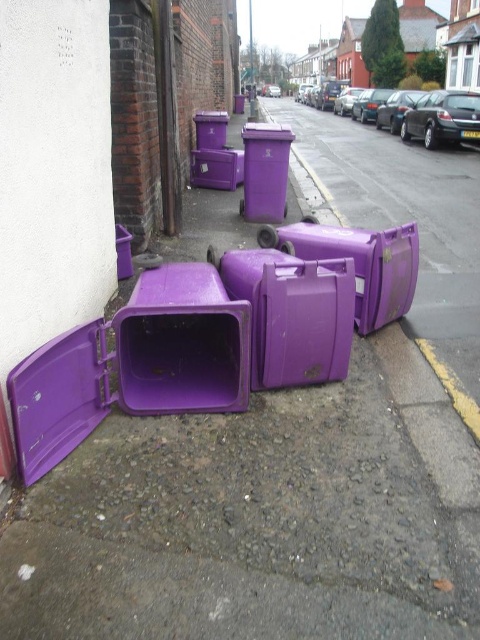
Question: Which point appears farthest from the camera in this image?

Choices:
 (A) (397, 228)
 (B) (252, 160)

Answer: (B)

Question: Does purple plastic bin at center appear over matte plastic trash can at center?

Choices:
 (A) no
 (B) yes

Answer: (A)

Question: Does purple plastic bin at center appear over matte plastic trash can at center?

Choices:
 (A) no
 (B) yes

Answer: (A)

Question: Does purple plastic bin at center appear over matte plastic trash can at center?

Choices:
 (A) yes
 (B) no

Answer: (B)

Question: Which point is farther to the camera?

Choices:
 (A) matte plastic trash can at center
 (B) purple plastic bin at center

Answer: (A)